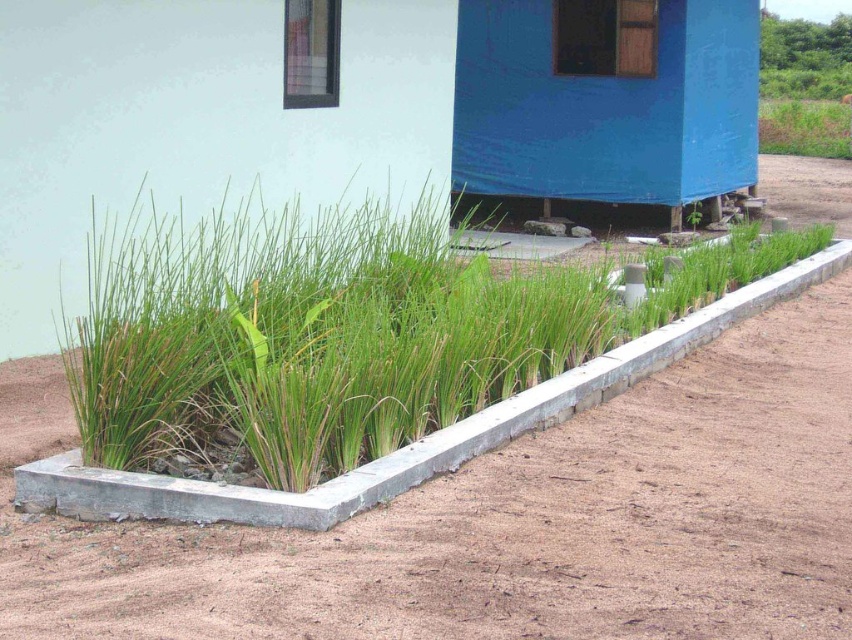
Does blue tarpaulin hut at center have a larger size compared to green grass at center?

Incorrect, blue tarpaulin hut at center is not larger than green grass at center.

Does point (729, 164) lie behind point (772, 198)?

No, (729, 164) is closer to viewer.

At what (x,y) coordinates should I click in order to perform the action: click on blue tarpaulin hut at center. Please return your answer as a coordinate pair (x, y). The width and height of the screenshot is (852, 640). Looking at the image, I should click on (350, 116).

Measure the distance between point (x=234, y=147) and camera.

Point (x=234, y=147) is 9.48 meters from camera.

Identify the location of blue tarpaulin hut at center. This screenshot has width=852, height=640. (350, 116).

Can you confirm if brown soil at lower left is taller than green grass at center?

No, brown soil at lower left is not taller than green grass at center.

Where is `brown soil at lower left`? brown soil at lower left is located at coordinates (522, 525).